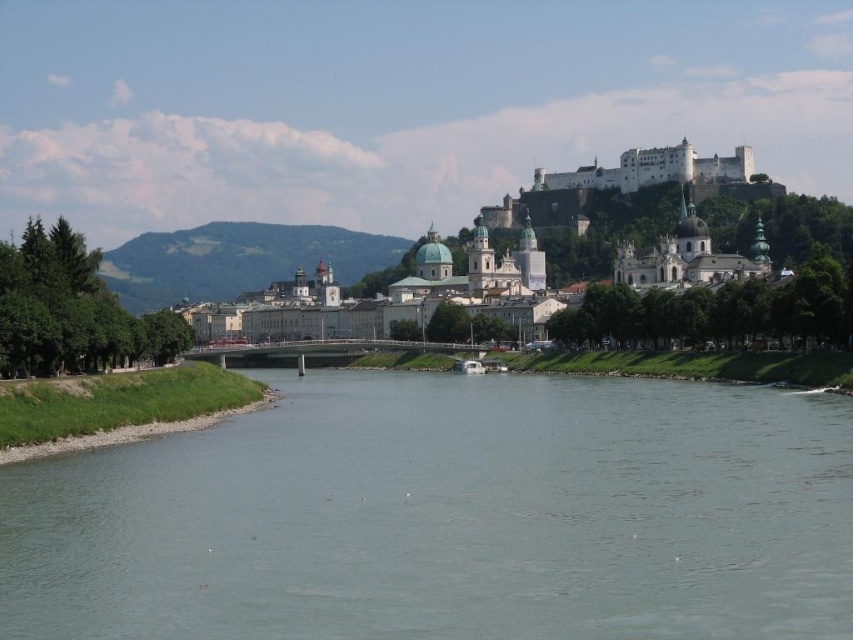
Question: Is clear water at center positioned at the back of white stone church at center?

Choices:
 (A) no
 (B) yes

Answer: (A)

Question: Is clear water at center further to camera compared to white stone church at center?

Choices:
 (A) no
 (B) yes

Answer: (A)

Question: Can you confirm if white stone church at center is thinner than white plastic boat at center?

Choices:
 (A) yes
 (B) no

Answer: (B)

Question: Which point appears farthest from the camera in this image?

Choices:
 (A) (262, 467)
 (B) (480, 369)
 (C) (309, 236)

Answer: (C)

Question: Which point appears farthest from the camera in this image?

Choices:
 (A) (463, 364)
 (B) (625, 280)

Answer: (B)

Question: Which point appears closest to the camera in this image?

Choices:
 (A) (238, 259)
 (B) (99, 467)

Answer: (B)